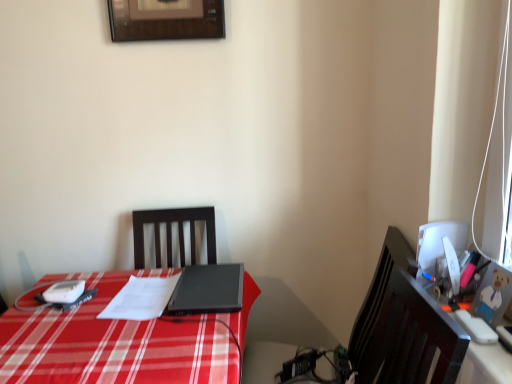
Locate an element on the screen. white glossy computer monitor at right is located at coordinates (439, 242).

Measure the distance between black matte laptop at center and camera.

The distance of black matte laptop at center from camera is 1.37 meters.

What is the approximate height of black matte laptop at center?

The height of black matte laptop at center is 1.77 inches.

Image resolution: width=512 pixels, height=384 pixels. What do you see at coordinates (141, 298) in the screenshot? I see `white paper at center` at bounding box center [141, 298].

Locate an element on the screen. This screenshot has height=384, width=512. white glossy computer monitor at right is located at coordinates (439, 242).

From the picture: Does black matte laptop at center lie behind white paper at center?

Yes, it is behind white paper at center.

From a real-world perspective, is black matte laptop at center above or below white paper at center?

From a real-world perspective, black matte laptop at center is physically above white paper at center.

Consider the image. Would you say black matte laptop at center is inside or outside white paper at center?

black matte laptop at center exists outside the volume of white paper at center.

Is black matte laptop at center aimed at white paper at center?

No, black matte laptop at center is not turned towards white paper at center.

What are the coordinates of `computer desk below the white glossy computer monitor at right (from the image's perspective)` in the screenshot? It's located at (486, 365).

Based on the photo, is white glossy computer monitor at right placed right next to orange plastic toy at right?

They are not placed beside each other.

Which is more to the right, white glossy computer monitor at right or orange plastic toy at right?

From the viewer's perspective, orange plastic toy at right appears more on the right side.

Which object is further away from the camera taking this photo, white glossy computer monitor at right or orange plastic toy at right?

white glossy computer monitor at right is further from the camera.

Is orange plastic toy at right smaller than black matte laptop at center?

Yes, orange plastic toy at right is smaller than black matte laptop at center.

Does orange plastic toy at right appear on the left side of black matte laptop at center?

Incorrect, orange plastic toy at right is not on the left side of black matte laptop at center.

Find the location of a particular element. This screenshot has height=384, width=512. computer desk above the black matte laptop at center (from a real-world perspective) is located at coordinates (486, 365).

Which is behind, point (500, 372) or point (168, 302)?

The point (168, 302) is more distant.

Find the location of a particular element. The image size is (512, 384). laptop that appears behind the white glossy computer monitor at right is located at coordinates (208, 290).

Is white glossy computer monitor at right to the left of black matte laptop at center from the viewer's perspective?

No.

In the image, is white glossy computer monitor at right positioned in front of or behind black matte laptop at center?

Visually, white glossy computer monitor at right is located in front of black matte laptop at center.

Does white glossy computer monitor at right have a greater height compared to black matte laptop at center?

Indeed, white glossy computer monitor at right has a greater height compared to black matte laptop at center.

Does white paper at center have a lesser height compared to white glossy computer monitor at right?

Correct, white paper at center is not as tall as white glossy computer monitor at right.

Is the depth of white paper at center greater than that of white glossy computer monitor at right?

Yes, the depth of white paper at center is greater than that of white glossy computer monitor at right.

Between point (129, 291) and point (417, 256), which one is positioned behind?

The point (129, 291) is more distant.

Who is bigger, white paper at center or white glossy computer monitor at right?

white paper at center.

Which object is positioned more to the right, white glossy computer monitor at right or white paper at center?

white glossy computer monitor at right.

Can you confirm if white glossy computer monitor at right is shorter than white paper at center?

Incorrect, the height of white glossy computer monitor at right does not fall short of that of white paper at center.

Is white glossy computer monitor at right facing towards white paper at center?

No, white glossy computer monitor at right is not oriented towards white paper at center.

Considering the sizes of objects white paper at center and orange plastic toy at right in the image provided, who is smaller, white paper at center or orange plastic toy at right?

Smaller between the two is orange plastic toy at right.

Which is more to the left, white paper at center or orange plastic toy at right?

From the viewer's perspective, white paper at center appears more on the left side.

Where is `notepad that appears below the orange plastic toy at right (from a real-world perspective)`? This screenshot has width=512, height=384. notepad that appears below the orange plastic toy at right (from a real-world perspective) is located at coordinates (141, 298).

Find the location of a particular element. notepad below the black matte laptop at center (from a real-world perspective) is located at coordinates (141, 298).

Where is `computer desk that appears below the white glossy computer monitor at right (from the image's perspective)`? The image size is (512, 384). computer desk that appears below the white glossy computer monitor at right (from the image's perspective) is located at coordinates (486, 365).

From the image, which object appears to be nearer to white paper at center, white glossy computer monitor at right or orange plastic toy at right?

white glossy computer monitor at right is closer to white paper at center.

Which object lies further to the anchor point black matte laptop at center, orange plastic toy at right or white glossy computer monitor at right?

orange plastic toy at right is further to black matte laptop at center.

Estimate the real-world distances between objects in this image. Which object is closer to black matte laptop at center, white glossy computer monitor at right or white paper at center?

Among the two, white paper at center is located nearer to black matte laptop at center.

Estimate the real-world distances between objects in this image. Which object is closer to black matte laptop at center, orange plastic toy at right or white paper at center?

Among the two, white paper at center is located nearer to black matte laptop at center.

When comparing their distances from black matte laptop at center, does white glossy computer monitor at right or orange plastic toy at right seem closer?

Among the two, white glossy computer monitor at right is located nearer to black matte laptop at center.

Looking at the image, which one is located closer to orange plastic toy at right, black matte laptop at center or white glossy computer monitor at right?

white glossy computer monitor at right is closer to orange plastic toy at right.

Looking at the image, which one is located closer to black matte laptop at center, white paper at center or orange plastic toy at right?

white paper at center.

Based on their spatial positions, is orange plastic toy at right or white paper at center closer to white glossy computer monitor at right?

orange plastic toy at right is positioned closer to the anchor white glossy computer monitor at right.

You are a GUI agent. You are given a task and a screenshot of the screen. Output one action in this format:
    pyautogui.click(x=<x>, y=<y>)
    Task: Click on the computer monitor between black matte laptop at center and orange plastic toy at right in the horizontal direction
    
    Given the screenshot: What is the action you would take?
    pyautogui.click(x=439, y=242)

Where is `laptop between white paper at center and white glossy computer monitor at right`? This screenshot has width=512, height=384. laptop between white paper at center and white glossy computer monitor at right is located at coordinates coord(208,290).

Identify the location of laptop between white paper at center and orange plastic toy at right in the horizontal direction. (208, 290).

This screenshot has height=384, width=512. In order to click on computer monitor between white paper at center and orange plastic toy at right in this screenshot , I will do `click(439, 242)`.